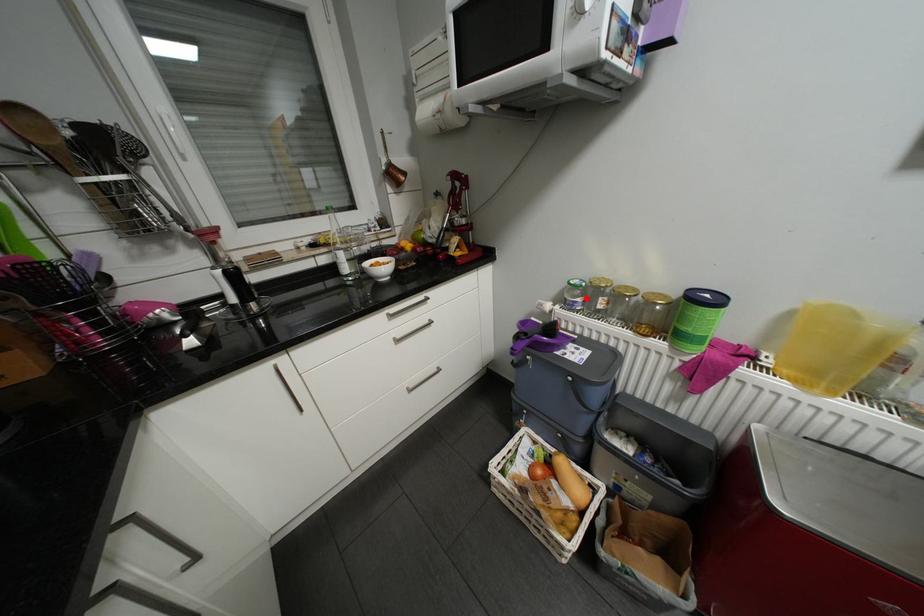
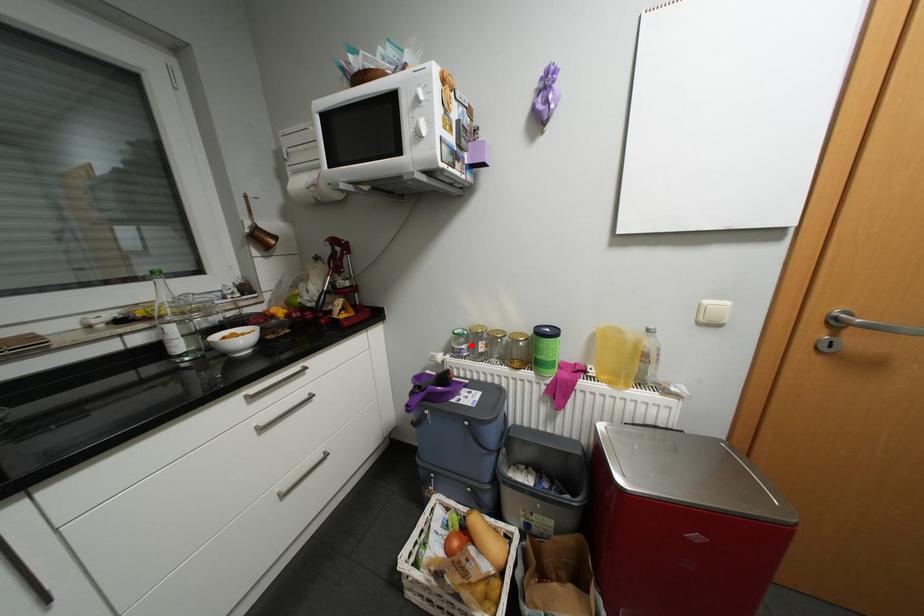
I am providing you with two images of the same scene from different viewpoints. A red point is marked on the first image and another point is marked on the second image. Is the marked point in image1 the same physical position as the marked point in image2?

Yes